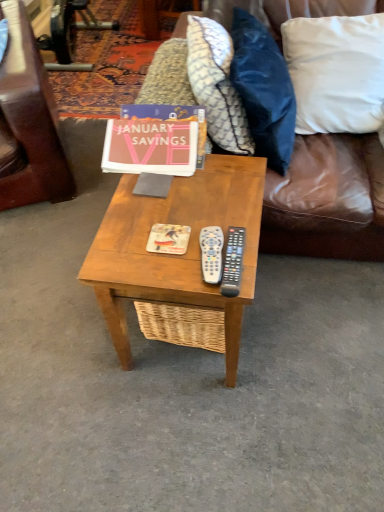
Where is `vacant space behind matte orange magazine at center`? The width and height of the screenshot is (384, 512). vacant space behind matte orange magazine at center is located at coordinates (175, 195).